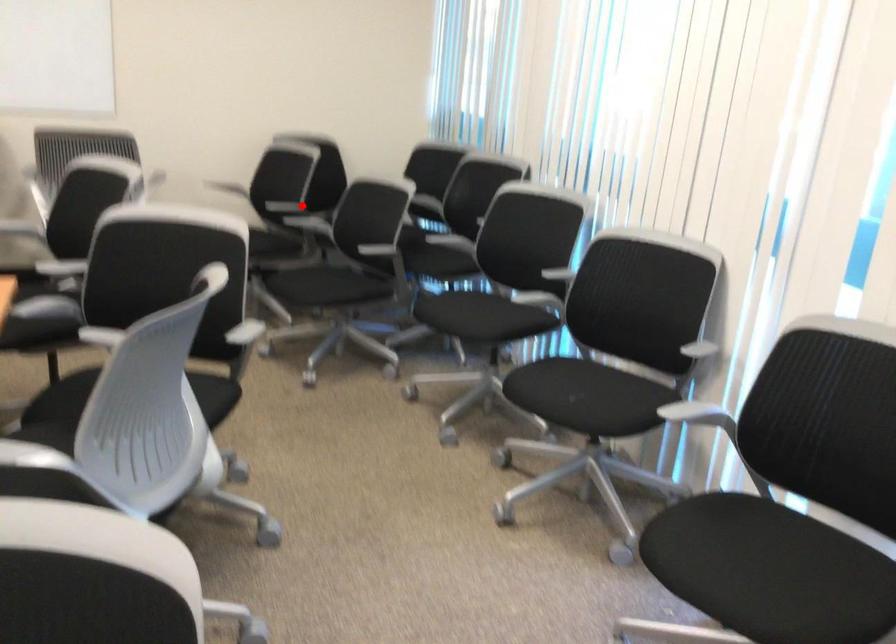
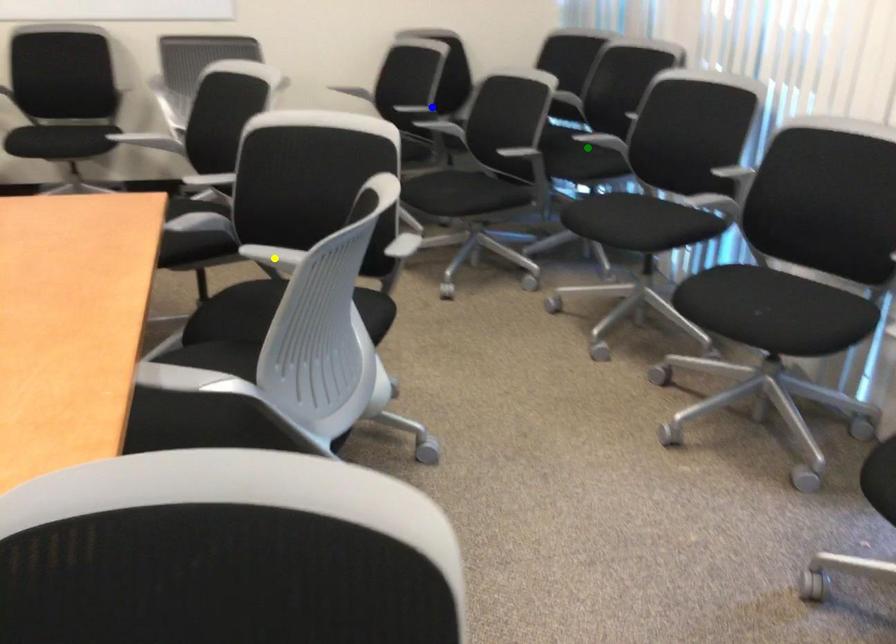
Question: I am providing you with two images of the same scene from different viewpoints. A red point is marked on the first image. You are given multiple points on the second image. In image 2, which mark is for the same physical point as the one in image 1?

Choices:
 (A) yellow point
 (B) blue point
 (C) green point

Answer: (B)